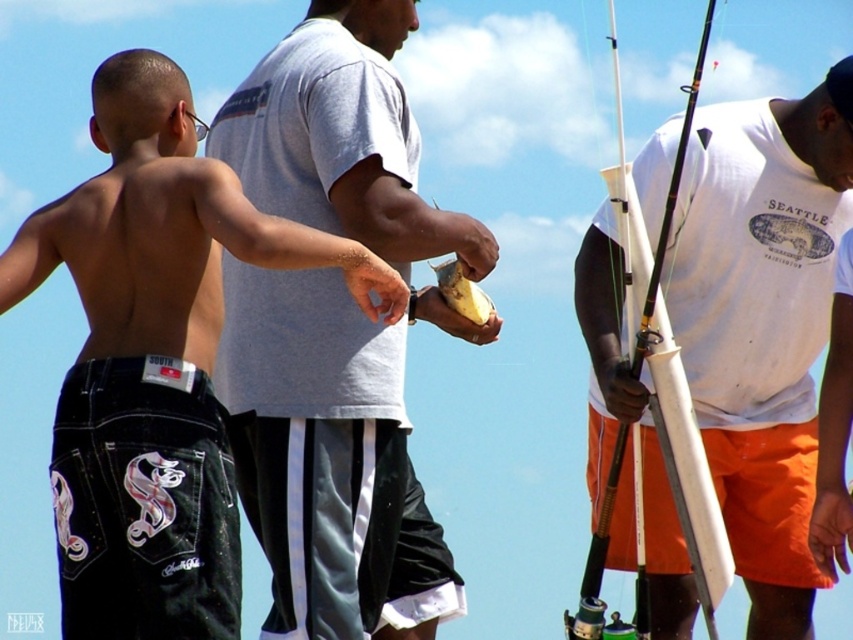
You are standing in the scene and see two pairs of black denim shorts at left and black denim shorts at lower left. Which pair is nearer to you?

The black denim shorts at left are closer to the viewer than the black denim shorts at lower left.